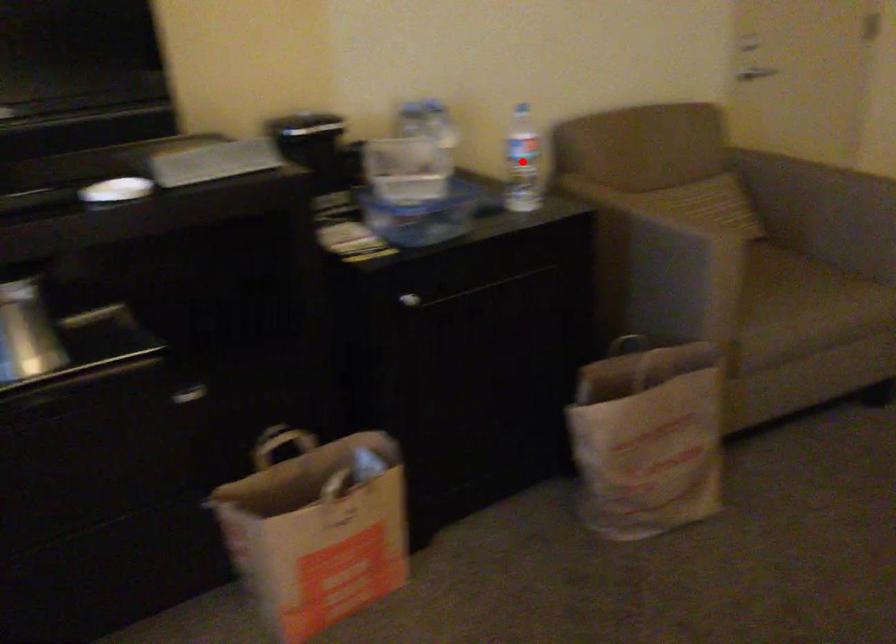
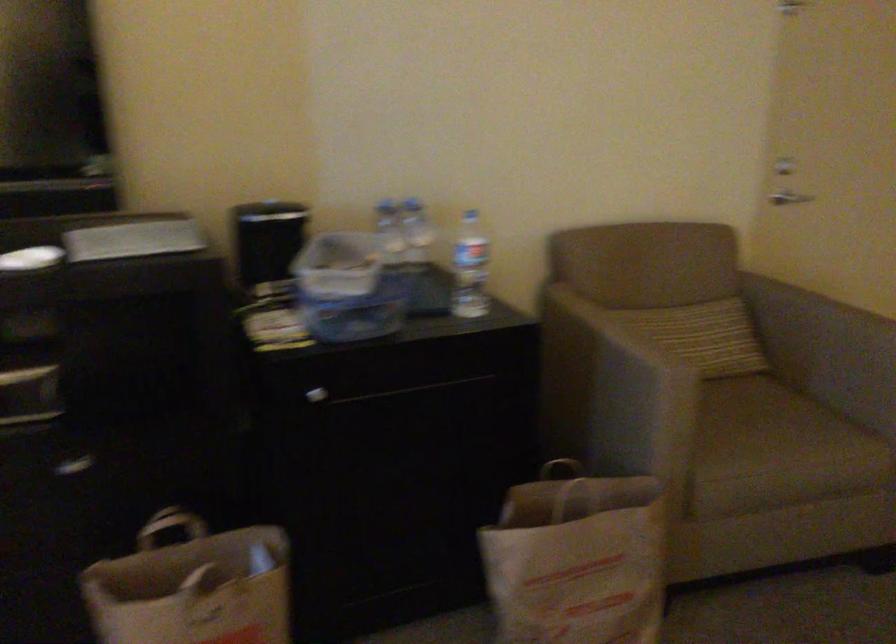
Where in the second image is the point corresponding to the highlighted location from the first image?

(470, 268)